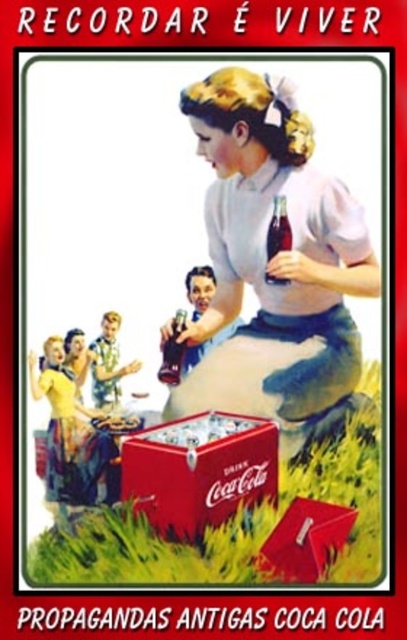
You are a delivery person who needs to place the translucent glass bottle at center into the matte red cooler at lower center. Based on the scene description, can you confirm if the bottle will fit inside the cooler?

The matte red cooler at lower center might be wider than the translucent glass bottle at center, so there is a possibility that the bottle will fit inside the cooler. However, the exact dimensions are not provided, so it is uncertain.

In the vintage Coca Cola advertisement, there are two bottles at the center. The woman is holding one of them. Which bottle is she holding, the translucent glass bottle at center or the matte glass bottle at center?

The woman is holding the translucent glass bottle at center because it is positioned over the matte glass bottle at center, indicating it is the one in her hand.